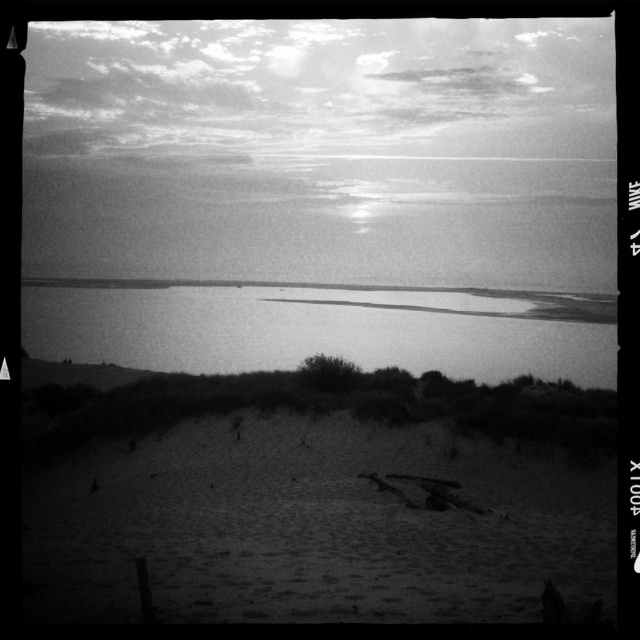
Question: Is smooth sand at lower center behind smooth water at center?

Choices:
 (A) no
 (B) yes

Answer: (A)

Question: Does smooth sand at lower center appear over smooth water at center?

Choices:
 (A) no
 (B) yes

Answer: (A)

Question: Does smooth sand at lower center have a larger size compared to smooth water at center?

Choices:
 (A) no
 (B) yes

Answer: (A)

Question: Which object is farther from the camera taking this photo?

Choices:
 (A) smooth sand at lower center
 (B) smooth water at center

Answer: (B)

Question: Which of the following is the closest to the observer?

Choices:
 (A) smooth water at center
 (B) smooth sand at lower center

Answer: (B)